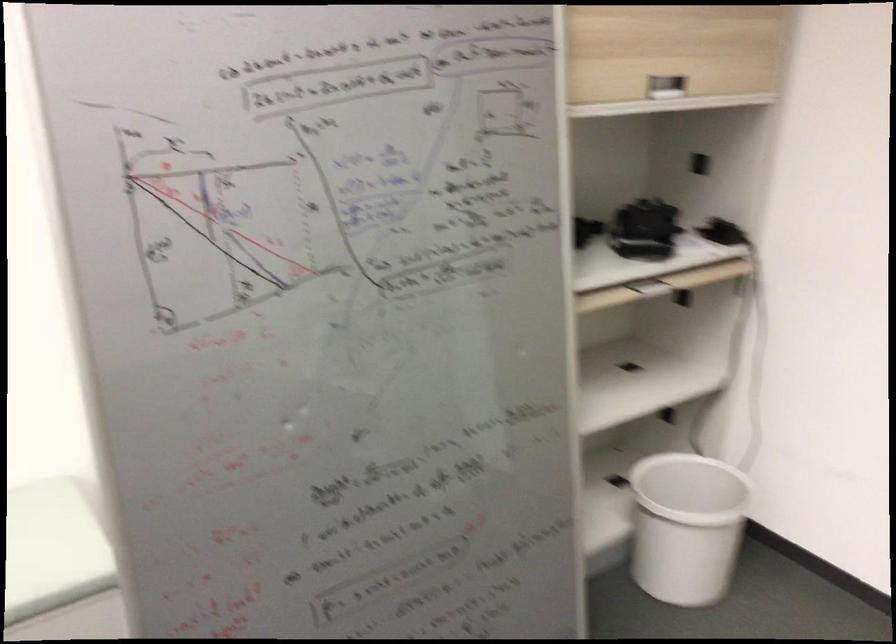
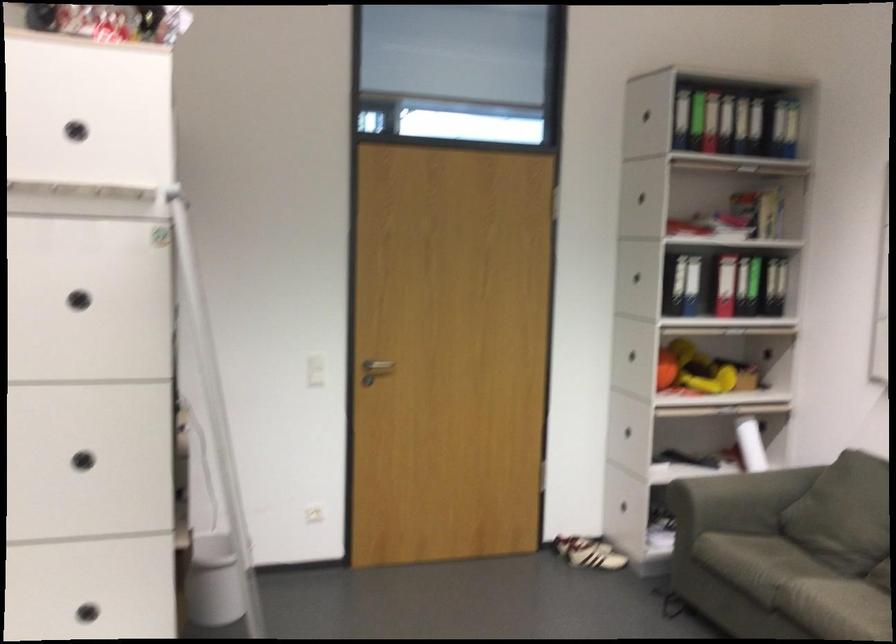
Locate, in the second image, the point that corresponds to pixel 152 277 in the first image.

(83, 456)